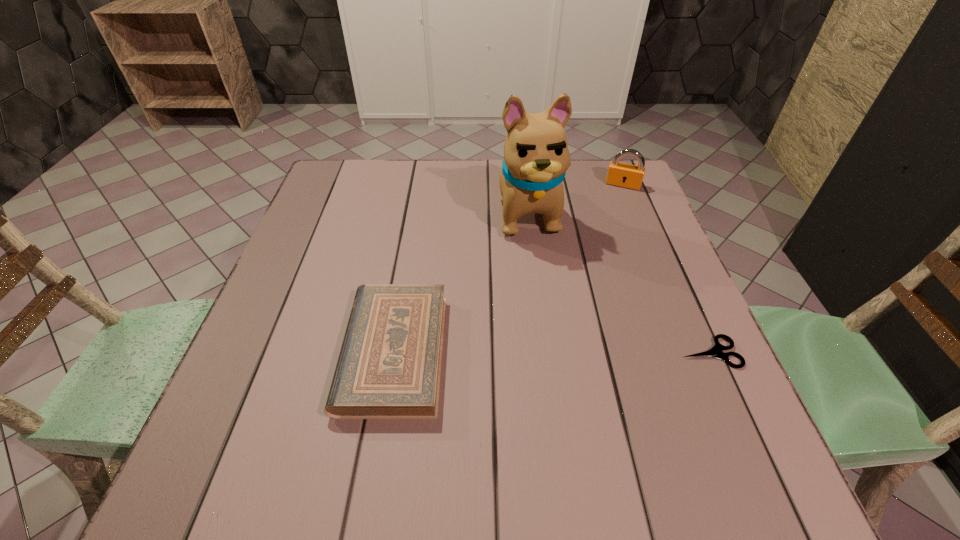
At what (x,y) coordinates should I click in order to perform the action: click on vacant area between the shears and the second shortest object. Please return your answer as a coordinate pair (x, y). Looking at the image, I should click on (552, 352).

The image size is (960, 540). I want to click on vacant area that lies between the padlock and the shears, so 666,268.

Where is `free space between the shortest object and the puppy`? The width and height of the screenshot is (960, 540). free space between the shortest object and the puppy is located at coordinates (619, 282).

Locate an element on the screen. free space between the third object from right to left and the third shortest object is located at coordinates (575, 198).

Where is `free space between the Bible and the puppy`? Image resolution: width=960 pixels, height=540 pixels. free space between the Bible and the puppy is located at coordinates 461,281.

Where is `free spot between the second object from left to right and the Bible`? This screenshot has height=540, width=960. free spot between the second object from left to right and the Bible is located at coordinates (461, 281).

This screenshot has width=960, height=540. In order to click on unoccupied position between the second tallest object and the shortest object in this screenshot , I will do [666, 268].

You are a GUI agent. You are given a task and a screenshot of the screen. Output one action in this format:
    pyautogui.click(x=<x>, y=<y>)
    Task: Click on the object that is the closest one to the puppy
    This screenshot has height=540, width=960.
    Given the screenshot: What is the action you would take?
    pyautogui.click(x=619, y=174)

The width and height of the screenshot is (960, 540). I want to click on object that is the closest to the shortest object, so click(536, 156).

Locate an element on the screen. This screenshot has width=960, height=540. vacant point that satisfies the following two spatial constraints: 1. on the back side of the second tallest object; 2. on the left side of the puppy is located at coordinates (524, 185).